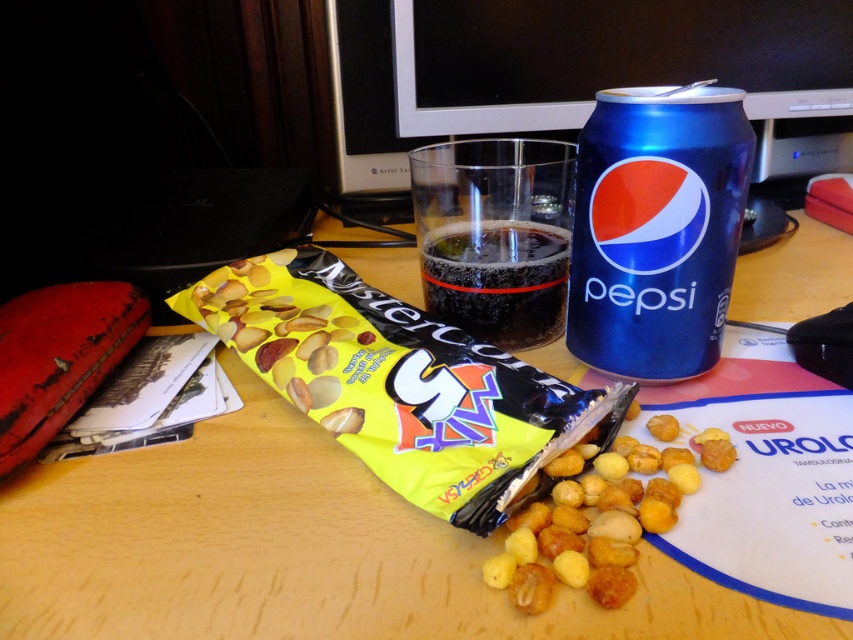
In the scene shown: You are organizing items on a desk. You have a yellow matte snack mix at center and a yellow matte snack at center. Which one takes up more vertical space?

The yellow matte snack mix at center takes up more vertical space because it has a greater height compared to the yellow matte snack at center.

You are looking at the desk setup and want to place a small sticker exactly halfway between point (404, 458) and point (618, 525). Will the sticker be closer to the yellow packet of Mister Caramelo candy or the blue Pepsi can?

The sticker placed halfway between point (404, 458) and point (618, 525) will be closer to the blue Pepsi can because point (404, 458) is closer to the viewer than point (618, 525), making the midpoint lean towards the Pepsi can.

You are a photographer setting up a shot of the desk. The yellow matte snack mix at center needs to be exactly 30 centimeters away from the camera lens to achieve the desired depth of field. Based on the current setup, is the snack mix within the required distance?

The yellow matte snack mix at center is currently 28.68 centimeters away from the camera, which is closer than the required 30 centimeters. To meet the depth of field requirement, the snack mix should be moved back approximately 1.32 centimeters.